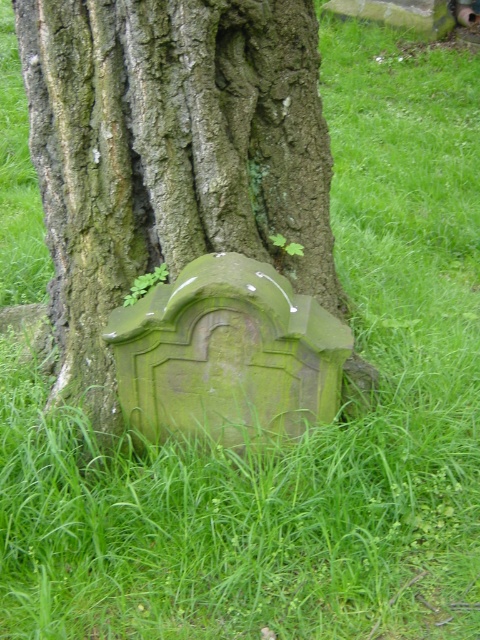
You are a gardener trying to clear the overgrown plants around the tree. You need to know the position of the green mossy stone at lower center relative to the green stone gravestone at lower center to avoid damaging them. Can you tell me which one is higher up on the tree?

The green mossy stone at lower center is above the green stone gravestone at lower center, so it is higher up on the tree.

You are standing in a forest clearing and see a weathered stone plaque partially embedded into the trunk of a large tree. There is a specific point at coordinates point (80, 241) that you need to reach. Considering you are 1.7 meters tall, can you comfortably reach that point without any tools?

The distance between you and point (80, 241) is 2.58 meters. Since the point is 2.58 meters away from you, and you are only 1.7 meters tall, you cannot comfortably reach it without assistance or tools.